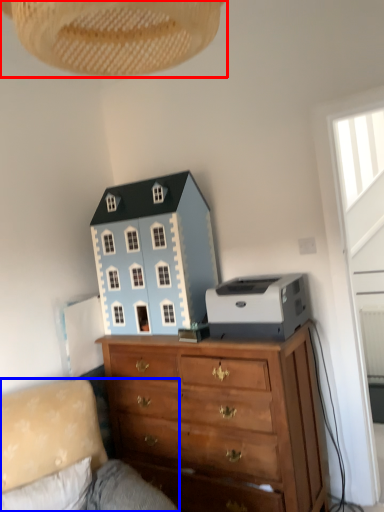
Question: Which object is further to the camera taking this photo, lamp (highlighted by a red box) or studio couch (highlighted by a blue box)?

Choices:
 (A) lamp
 (B) studio couch

Answer: (B)